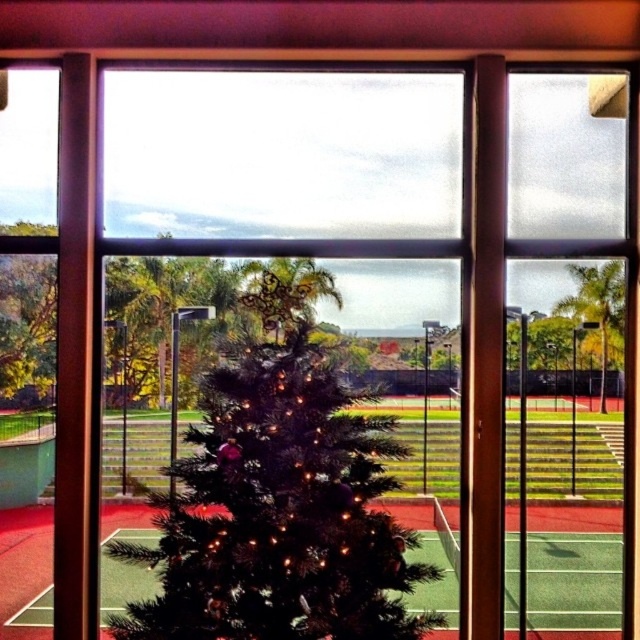
You are a drone operator planning to fly a drone from the green matte tree at left to the green artificial turf at center. Given that your drone has a maximum flight distance of 20 inches, will it be able to reach the target without recharging?

The distance between the green artificial turf at center and the green matte tree at left is 20.73 inches, which exceeds the drone operator drone maximum flight distance of 20 inches. Therefore, the drone will not be able to reach the target without recharging.

You are standing in the room looking through the window. You see the green matte christmas tree at center and the green artificial turf at center. Which object is closer to you?

The green matte christmas tree at center is closer to you because it is located above the green artificial turf at center, indicating it is positioned nearer in the scene.

You are an interior designer assessing the space between the green matte christmas tree at center and the green matte tree at left. Which tree would you recommend placing closer to the window to ensure both are visible in the photo? Explain your reasoning based on their sizes.

The green matte christmas tree at center is much taller than the green matte tree at left. To ensure both are visible in the photo, the taller green matte christmas tree at center should be placed closer to the window. This way, its height won t block the view of the shorter green matte tree at left.